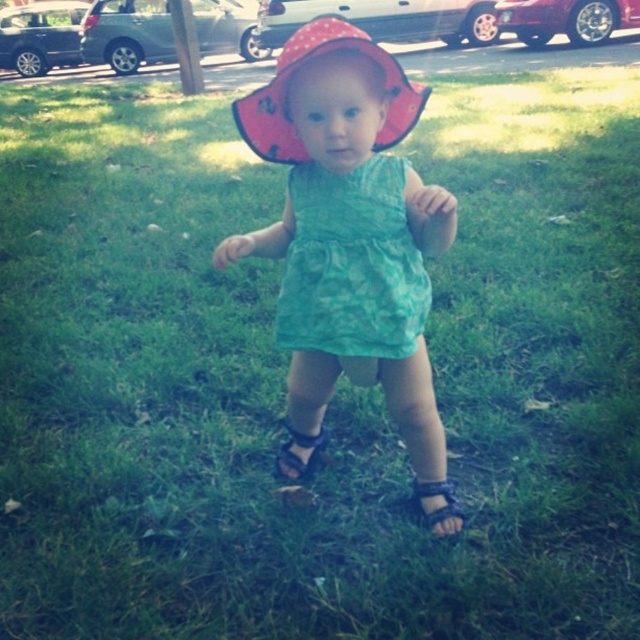
Question: Is polka dot fabric hat at center smaller than black fabric sandal at center?

Choices:
 (A) yes
 (B) no

Answer: (B)

Question: Estimate the real-world distances between objects in this image. Which object is farther from the matte green dress at center?

Choices:
 (A) polka dot fabric hat at center
 (B) green tie-dye dress at center
 (C) black fabric sandal at lower center
 (D) black fabric sandal at center

Answer: (C)

Question: Which point is closer to the camera?

Choices:
 (A) (444, 493)
 (B) (410, 301)
 (C) (285, 444)

Answer: (B)

Question: Can you confirm if green tie-dye dress at center is thinner than polka dot fabric hat at center?

Choices:
 (A) no
 (B) yes

Answer: (B)

Question: Which object is closer to the camera taking this photo?

Choices:
 (A) green tie-dye dress at center
 (B) polka dot fabric hat at center
 (C) matte green dress at center

Answer: (C)

Question: Is black fabric sandal at center wider than black fabric sandal at lower center?

Choices:
 (A) no
 (B) yes

Answer: (B)